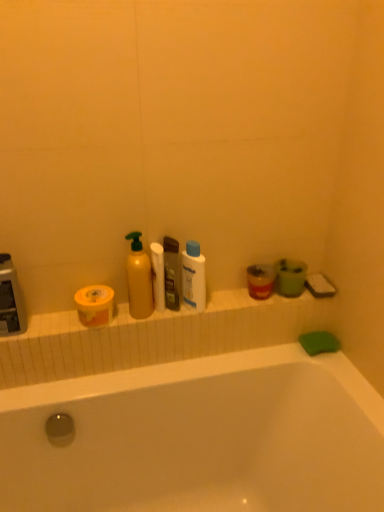
Locate an element on the screen. This screenshot has width=384, height=512. vacant space to the left of yellow matte toilet paper at left, which appears as the 1th toilet paper when viewed from the left is located at coordinates (54, 326).